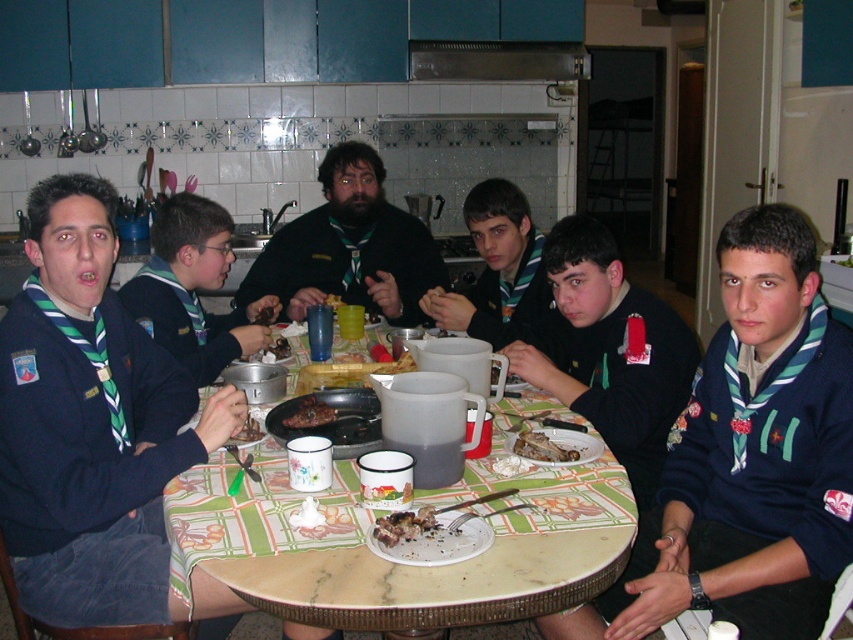
Who is shorter, brushed metal exhaust hood at upper center or brown crispy meat at center?

brown crispy meat at center

Describe the element at coordinates (497, 60) in the screenshot. The image size is (853, 640). I see `brushed metal exhaust hood at upper center` at that location.

Between point (546, 65) and point (322, 420), which one is positioned behind?

Point (546, 65)

I want to click on brushed metal exhaust hood at upper center, so click(x=497, y=60).

Between matte black shirt at center and brushed metal exhaust hood at upper center, which one appears on the right side from the viewer's perspective?

Positioned to the right is brushed metal exhaust hood at upper center.

Which is more to the left, matte black shirt at center or brushed metal exhaust hood at upper center?

matte black shirt at center

Image resolution: width=853 pixels, height=640 pixels. What do you see at coordinates (193, 289) in the screenshot?
I see `matte black shirt at center` at bounding box center [193, 289].

This screenshot has width=853, height=640. In order to click on matte black shirt at center in this screenshot , I will do `click(193, 289)`.

Is brown crispy bread at table center closer to the viewer compared to yellow matte plastic cup at center?

That is True.

Who is more distant from viewer, (x=525, y=444) or (x=341, y=298)?

Positioned behind is point (x=341, y=298).

The width and height of the screenshot is (853, 640). Identify the location of brown crispy bread at table center. (541, 448).